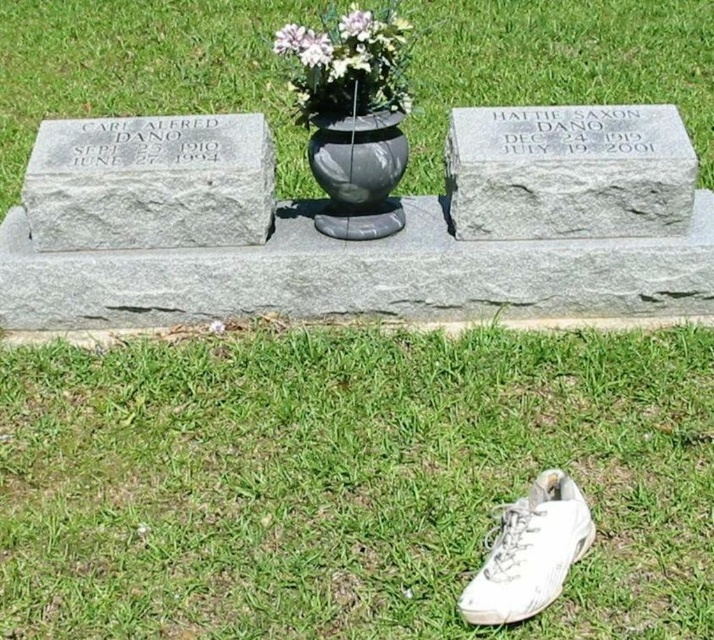
Is green grass at center in front of black marble vase at center?

That is False.

Between point (11, 148) and point (351, 163), which one is positioned behind?

Point (11, 148)

This screenshot has width=714, height=640. Describe the element at coordinates (145, 68) in the screenshot. I see `green grass at center` at that location.

Where is `green grass at center`? The width and height of the screenshot is (714, 640). green grass at center is located at coordinates (145, 68).

Which is behind, point (560, 150) or point (565, 496)?

The point (560, 150) is behind.

Image resolution: width=714 pixels, height=640 pixels. In order to click on gray granite stone at center in this screenshot , I will do `click(568, 172)`.

This screenshot has width=714, height=640. What are the coordinates of `gray granite stone at center` in the screenshot? It's located at (568, 172).

Can you confirm if gray stone gravestone at upper left is positioned above white leather shoe at lower right?

Indeed, gray stone gravestone at upper left is positioned over white leather shoe at lower right.

Describe the element at coordinates (149, 182) in the screenshot. The image size is (714, 640). I see `gray stone gravestone at upper left` at that location.

Image resolution: width=714 pixels, height=640 pixels. What are the coordinates of `gray stone gravestone at upper left` in the screenshot? It's located at (149, 182).